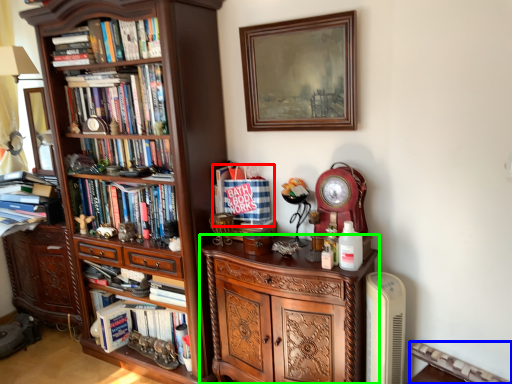
Question: Estimate the real-world distances between objects in this image. Which object is farther from book (highlighted by a red box), radiator (highlighted by a blue box) or cabinetry (highlighted by a green box)?

Choices:
 (A) radiator
 (B) cabinetry

Answer: (A)